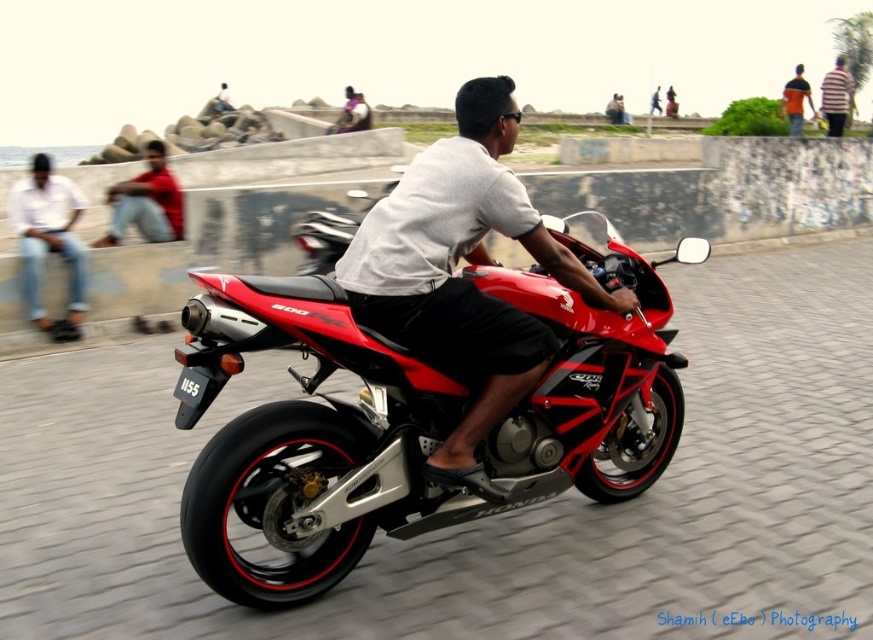
You are a photographer trying to capture both the white cotton shirt at left and the matte red shirt at left in a single frame. Since your camera has a fixed focus that can only accommodate one shirt width, which shirt should you focus on to ensure it fits entirely within the frame?

The white cotton shirt at left has a smaller width compared to the matte red shirt at left. Therefore, focusing on the white cotton shirt at left ensures it will fit entirely within the frame since it is narrower.

The rider is wearing a light gray t shirt and dark shorts. There is a matte red shirt at left represented by point (x=146, y=202). Is the matte red shirt at left part of the rider or a different person?

The matte red shirt at left is part of a different person because the rider is wearing a light gray t shirt.

You are a photographer trying to capture the shiny red motorcycle at center and the striped shirt at upper right in the same frame. Based on their positions, which object is closer to the camera?

The shiny red motorcycle at center is closer to the camera because it is positioned under the striped shirt at upper right, indicating it is in a lower plane relative to the shirt, which is higher in the frame.